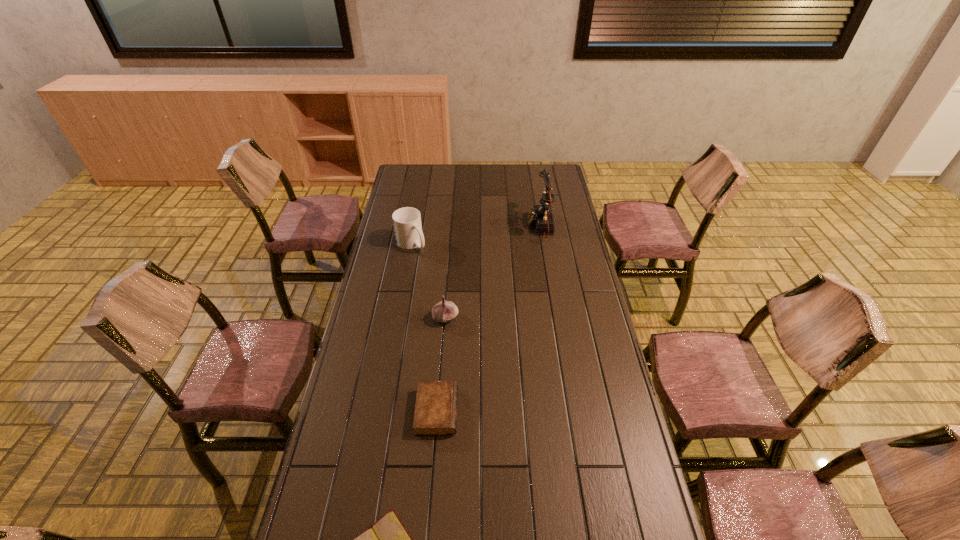
Find the location of a particular element. The width and height of the screenshot is (960, 540). the rightmost object is located at coordinates (541, 216).

The height and width of the screenshot is (540, 960). Identify the location of telephone. (541, 216).

The height and width of the screenshot is (540, 960). What are the coordinates of `the fourth shortest object` in the screenshot? It's located at (407, 221).

Where is `the third tallest object`? This screenshot has height=540, width=960. the third tallest object is located at coordinates (443, 311).

At what (x,y) coordinates should I click in order to perform the action: click on the third farthest object. Please return your answer as a coordinate pair (x, y). Looking at the image, I should click on (443, 311).

At what (x,y) coordinates should I click in order to perform the action: click on the second nearest object. Please return your answer as a coordinate pair (x, y). The image size is (960, 540). Looking at the image, I should click on (435, 413).

Where is `the second shortest object`? This screenshot has height=540, width=960. the second shortest object is located at coordinates pyautogui.click(x=435, y=413).

Identify the location of free space located 0.130m on the dial of the rightmost object. (500, 226).

Identify the location of free location located on the dial of the rightmost object. Image resolution: width=960 pixels, height=540 pixels. (509, 226).

Image resolution: width=960 pixels, height=540 pixels. In order to click on vacant space located 0.320m on the dial of the rightmost object in this screenshot , I will do `click(460, 226)`.